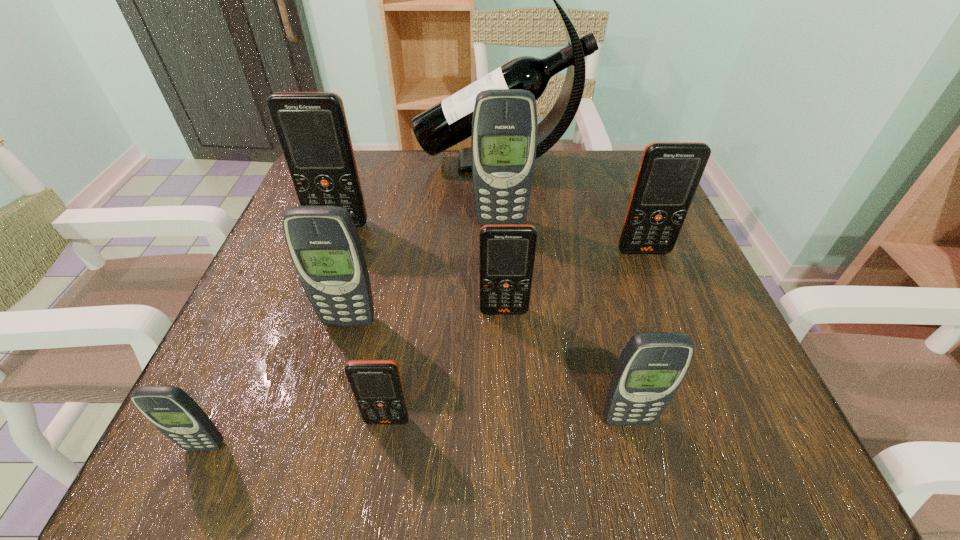
Where is `the tallest object`? This screenshot has height=540, width=960. the tallest object is located at coordinates (449, 122).

This screenshot has height=540, width=960. Find the location of `black wine bottle`. black wine bottle is located at coordinates click(449, 122).

Locate an element on the screen. the biggest orange cellular telephone is located at coordinates (312, 129).

The image size is (960, 540). In order to click on the farthest orange cellular telephone in this screenshot , I will do `click(312, 129)`.

In order to click on the farthest gray cellular telephone in this screenshot , I will do `click(504, 127)`.

At what (x,y) coordinates should I click in order to perform the action: click on the biggest gray cellular telephone. Please return your answer as a coordinate pair (x, y). This screenshot has height=540, width=960. Looking at the image, I should click on (504, 127).

At what (x,y) coordinates should I click in order to perform the action: click on the rightmost object. Please return your answer as a coordinate pair (x, y). The image size is (960, 540). Looking at the image, I should click on (669, 174).

The image size is (960, 540). In order to click on the rightmost cellular telephone in this screenshot , I will do `click(669, 174)`.

At what (x,y) coordinates should I click in order to perform the action: click on the second biggest gray cellular telephone. Please return your answer as a coordinate pair (x, y). Looking at the image, I should click on (324, 244).

You are a GUI agent. You are given a task and a screenshot of the screen. Output one action in this format:
    pyautogui.click(x=<x>, y=<y>)
    Task: Click on the fourth nearest cellular telephone
    The height and width of the screenshot is (540, 960).
    Given the screenshot: What is the action you would take?
    pyautogui.click(x=324, y=244)